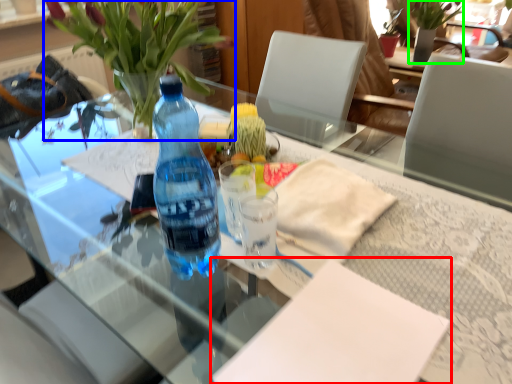
Question: Which object is the closest to the notepad (highlighted by a red box)? Choose among these: houseplant (highlighted by a blue box) or bouquet (highlighted by a green box).

Choices:
 (A) houseplant
 (B) bouquet

Answer: (A)